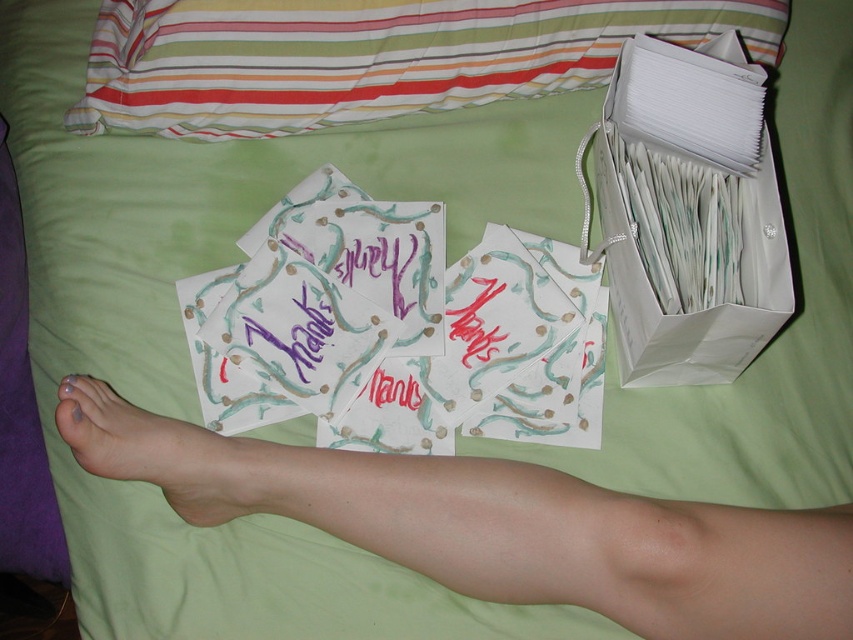
Does pale skin leg at lower center have a lesser width compared to green fabric pillow at upper center?

Yes, pale skin leg at lower center is thinner than green fabric pillow at upper center.

Which of these two, pale skin leg at lower center or green fabric pillow at upper center, stands taller?

Standing taller between the two is pale skin leg at lower center.

Does point (618, 624) lie in front of point (257, 28)?

Yes, it is in front of point (257, 28).

What are the coordinates of `pale skin leg at lower center` in the screenshot? It's located at (497, 525).

Which is below, pale skin leg at lower center or nude skin at lower center?

pale skin leg at lower center is below.

Looking at this image, can you confirm if pale skin leg at lower center is positioned above nude skin at lower center?

Actually, pale skin leg at lower center is below nude skin at lower center.

Which is in front, point (839, 556) or point (114, 440)?

Positioned in front is point (839, 556).

The image size is (853, 640). Find the location of `pale skin leg at lower center`. pale skin leg at lower center is located at coordinates tap(497, 525).

Which of these two, green fabric pillow at upper center or white paper bag at upper right, stands shorter?

green fabric pillow at upper center

Is the position of green fabric pillow at upper center more distant than that of white paper bag at upper right?

That is True.

Who is more distant from viewer, (x=486, y=72) or (x=706, y=93)?

The point (x=486, y=72) is behind.

Where is `green fabric pillow at upper center`? green fabric pillow at upper center is located at coordinates (368, 56).